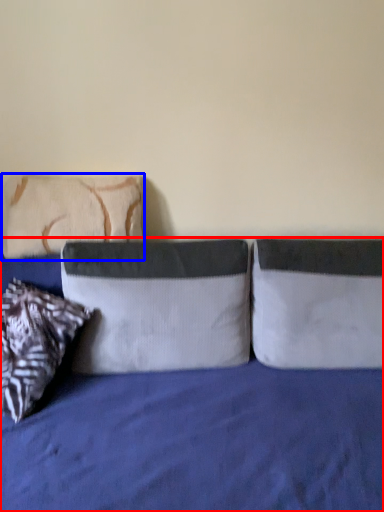
Question: Among these objects, which one is farthest to the camera, bed (highlighted by a red box) or pillow (highlighted by a blue box)?

Choices:
 (A) bed
 (B) pillow

Answer: (B)